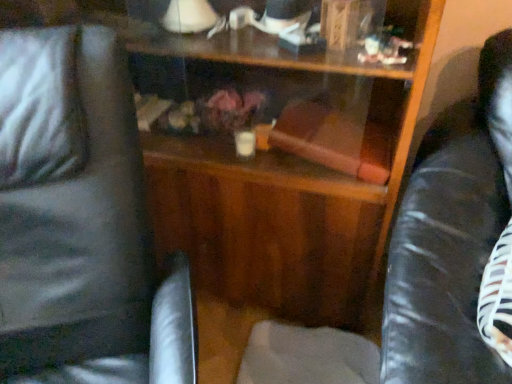
What do you see at coordinates (450, 239) in the screenshot? I see `black leather swivel chair at right, the 2th swivel chair when ordered from left to right` at bounding box center [450, 239].

Image resolution: width=512 pixels, height=384 pixels. I want to click on black leather swivel chair at right, the 2th swivel chair when ordered from left to right, so click(450, 239).

Image resolution: width=512 pixels, height=384 pixels. What do you see at coordinates (80, 222) in the screenshot? I see `black leather swivel chair at left, marked as the 1th swivel chair in a left-to-right arrangement` at bounding box center [80, 222].

I want to click on black leather swivel chair at left, which is counted as the 2th swivel chair, starting from the right, so click(80, 222).

What is the approximate width of black leather swivel chair at left, which is counted as the 2th swivel chair, starting from the right?

black leather swivel chair at left, which is counted as the 2th swivel chair, starting from the right, is 26.90 inches in width.

The height and width of the screenshot is (384, 512). I want to click on black leather swivel chair at right, the first swivel chair viewed from the right, so click(450, 239).

Does black leather swivel chair at right, the first swivel chair viewed from the right, appear on the left side of black leather swivel chair at left, which is counted as the 2th swivel chair, starting from the right?

No, black leather swivel chair at right, the first swivel chair viewed from the right, is not to the left of black leather swivel chair at left, which is counted as the 2th swivel chair, starting from the right.

Considering the positions of objects black leather swivel chair at right, the first swivel chair viewed from the right, and black leather swivel chair at left, marked as the 1th swivel chair in a left-to-right arrangement, in the image provided, who is behind, black leather swivel chair at right, the first swivel chair viewed from the right, or black leather swivel chair at left, marked as the 1th swivel chair in a left-to-right arrangement,?

black leather swivel chair at right, the first swivel chair viewed from the right, is further away from the camera.

Is point (422, 262) positioned in front of point (95, 164)?

No, it is behind (95, 164).

From the image's perspective, which one is positioned lower, black leather swivel chair at right, the first swivel chair viewed from the right, or black leather swivel chair at left, which is counted as the 2th swivel chair, starting from the right?

black leather swivel chair at left, which is counted as the 2th swivel chair, starting from the right, from the image's perspective.

From a real-world perspective, is black leather swivel chair at right, the 2th swivel chair when ordered from left to right, over black leather swivel chair at left, which is counted as the 2th swivel chair, starting from the right?

Correct, in the physical world, black leather swivel chair at right, the 2th swivel chair when ordered from left to right, is higher than black leather swivel chair at left, which is counted as the 2th swivel chair, starting from the right.

Can you confirm if black leather swivel chair at right, the first swivel chair viewed from the right, is wider than black leather swivel chair at left, marked as the 1th swivel chair in a left-to-right arrangement?

Incorrect, the width of black leather swivel chair at right, the first swivel chair viewed from the right, does not surpass that of black leather swivel chair at left, marked as the 1th swivel chair in a left-to-right arrangement.

In the scene shown: Can you confirm if black leather swivel chair at right, the first swivel chair viewed from the right, is taller than black leather swivel chair at left, which is counted as the 2th swivel chair, starting from the right?

No, black leather swivel chair at right, the first swivel chair viewed from the right, is not taller than black leather swivel chair at left, which is counted as the 2th swivel chair, starting from the right.

Considering the sizes of black leather swivel chair at right, the 2th swivel chair when ordered from left to right, and black leather swivel chair at left, which is counted as the 2th swivel chair, starting from the right, in the image, is black leather swivel chair at right, the 2th swivel chair when ordered from left to right, bigger or smaller than black leather swivel chair at left, which is counted as the 2th swivel chair, starting from the right,?

Considering their sizes, black leather swivel chair at right, the 2th swivel chair when ordered from left to right, takes up less space than black leather swivel chair at left, which is counted as the 2th swivel chair, starting from the right.

Is black leather swivel chair at left, marked as the 1th swivel chair in a left-to-right arrangement, located within black leather swivel chair at right, the 2th swivel chair when ordered from left to right?

No.

Is black leather swivel chair at right, the 2th swivel chair when ordered from left to right, next to black leather swivel chair at left, marked as the 1th swivel chair in a left-to-right arrangement?

black leather swivel chair at right, the 2th swivel chair when ordered from left to right, is not next to black leather swivel chair at left, marked as the 1th swivel chair in a left-to-right arrangement, and they're not touching.

Is black leather swivel chair at right, the first swivel chair viewed from the right, facing towards black leather swivel chair at left, which is counted as the 2th swivel chair, starting from the right?

No.

Can you tell me how much black leather swivel chair at right, the first swivel chair viewed from the right, and black leather swivel chair at left, which is counted as the 2th swivel chair, starting from the right, differ in facing direction?

Result: The facing directions of black leather swivel chair at right, the first swivel chair viewed from the right, and black leather swivel chair at left, which is counted as the 2th swivel chair, starting from the right, are 40.7 degrees apart.

How distant is black leather swivel chair at right, the first swivel chair viewed from the right, from black leather swivel chair at left, marked as the 1th swivel chair in a left-to-right arrangement?

black leather swivel chair at right, the first swivel chair viewed from the right, is 22.13 inches away from black leather swivel chair at left, marked as the 1th swivel chair in a left-to-right arrangement.

This screenshot has height=384, width=512. I want to click on swivel chair that appears in front of the black leather swivel chair at right, the 2th swivel chair when ordered from left to right, so click(x=80, y=222).

Is black leather swivel chair at left, which is counted as the 2th swivel chair, starting from the right, at the left side of black leather swivel chair at right, the 2th swivel chair when ordered from left to right?

Yes, black leather swivel chair at left, which is counted as the 2th swivel chair, starting from the right, is to the left of black leather swivel chair at right, the 2th swivel chair when ordered from left to right.

Considering their positions, is black leather swivel chair at left, which is counted as the 2th swivel chair, starting from the right, located in front of or behind black leather swivel chair at right, the first swivel chair viewed from the right?

Visually, black leather swivel chair at left, which is counted as the 2th swivel chair, starting from the right, is located in front of black leather swivel chair at right, the first swivel chair viewed from the right.

Which is closer to the camera, (121, 348) or (484, 345)?

Point (121, 348).

From the image's perspective, is black leather swivel chair at left, marked as the 1th swivel chair in a left-to-right arrangement, located above or below black leather swivel chair at right, the first swivel chair viewed from the right?

Based on their image positions, black leather swivel chair at left, marked as the 1th swivel chair in a left-to-right arrangement, is located beneath black leather swivel chair at right, the first swivel chair viewed from the right.

From a real-world perspective, is black leather swivel chair at left, which is counted as the 2th swivel chair, starting from the right, physically located above or below black leather swivel chair at right, the 2th swivel chair when ordered from left to right?

Clearly, from a real-world perspective, black leather swivel chair at left, which is counted as the 2th swivel chair, starting from the right, is below black leather swivel chair at right, the 2th swivel chair when ordered from left to right.

Is black leather swivel chair at left, marked as the 1th swivel chair in a left-to-right arrangement, wider or thinner than black leather swivel chair at right, the 2th swivel chair when ordered from left to right?

Clearly, black leather swivel chair at left, marked as the 1th swivel chair in a left-to-right arrangement, has more width compared to black leather swivel chair at right, the 2th swivel chair when ordered from left to right.

In terms of height, does black leather swivel chair at left, marked as the 1th swivel chair in a left-to-right arrangement, look taller or shorter compared to black leather swivel chair at right, the first swivel chair viewed from the right?

black leather swivel chair at left, marked as the 1th swivel chair in a left-to-right arrangement, is taller than black leather swivel chair at right, the first swivel chair viewed from the right.

Can you confirm if black leather swivel chair at left, which is counted as the 2th swivel chair, starting from the right, is bigger than black leather swivel chair at right, the 2th swivel chair when ordered from left to right?

Indeed, black leather swivel chair at left, which is counted as the 2th swivel chair, starting from the right, has a larger size compared to black leather swivel chair at right, the 2th swivel chair when ordered from left to right.

Looking at this image, is black leather swivel chair at left, marked as the 1th swivel chair in a left-to-right arrangement, surrounding black leather swivel chair at right, the first swivel chair viewed from the right?

No.

Is black leather swivel chair at left, marked as the 1th swivel chair in a left-to-right arrangement, directly adjacent to black leather swivel chair at right, the 2th swivel chair when ordered from left to right?

No.

Is black leather swivel chair at left, marked as the 1th swivel chair in a left-to-right arrangement, turned away from black leather swivel chair at right, the first swivel chair viewed from the right?

black leather swivel chair at left, marked as the 1th swivel chair in a left-to-right arrangement, is not turned away from black leather swivel chair at right, the first swivel chair viewed from the right.

How different are the orientations of black leather swivel chair at left, marked as the 1th swivel chair in a left-to-right arrangement, and black leather swivel chair at right, the first swivel chair viewed from the right, in degrees?

40.7 degrees.

I want to click on swivel chair positioned vertically above the black leather swivel chair at left, which is counted as the 2th swivel chair, starting from the right (from a real-world perspective), so click(450, 239).

Where is `swivel chair above the black leather swivel chair at left, marked as the 1th swivel chair in a left-to-right arrangement (from the image's perspective)`? This screenshot has height=384, width=512. swivel chair above the black leather swivel chair at left, marked as the 1th swivel chair in a left-to-right arrangement (from the image's perspective) is located at coordinates (450, 239).

Find the location of a particular element. This screenshot has height=384, width=512. swivel chair above the black leather swivel chair at left, which is counted as the 2th swivel chair, starting from the right (from a real-world perspective) is located at coordinates (450, 239).